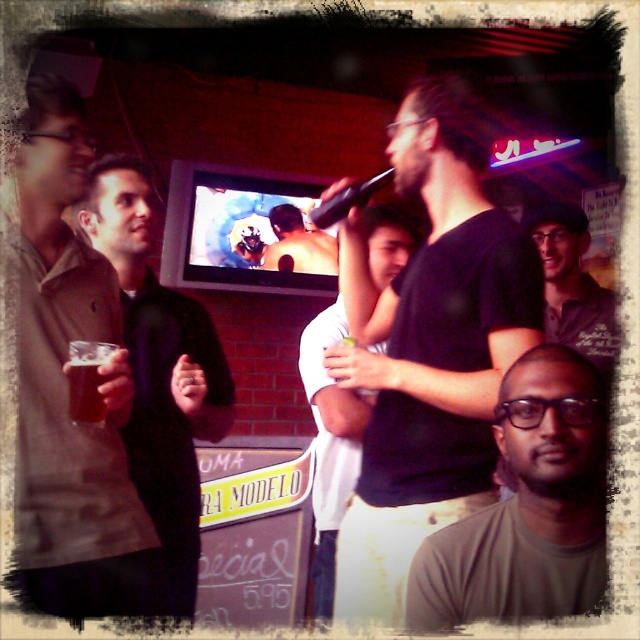
You are organizing a charity event and need to place two name tags on a table. The name tags must be placed in such a way that the one for the person wearing the matte olive green shirt at center is smaller than the one for the dark green polo shirt at center. Given that the size of the name tags should correspond to the visual prominence of their shirts in the image, will this arrangement work?

The matte olive green shirt at center occupies less space than dark green polo shirt at center, so yes, placing the name tag for the matte olive green shirt at center smaller than the one for the dark green polo shirt at center aligns with their visual prominence in the image.

You are standing in the bar and want to take a photo of the point at coordinates [499,570]. The camera you have can focus on objects within 5 feet. Will the point be in focus?

The point at coordinates [499,570] is 4.85 feet from the camera, which is within the 5 feet focus range. Therefore, the point will be in focus.